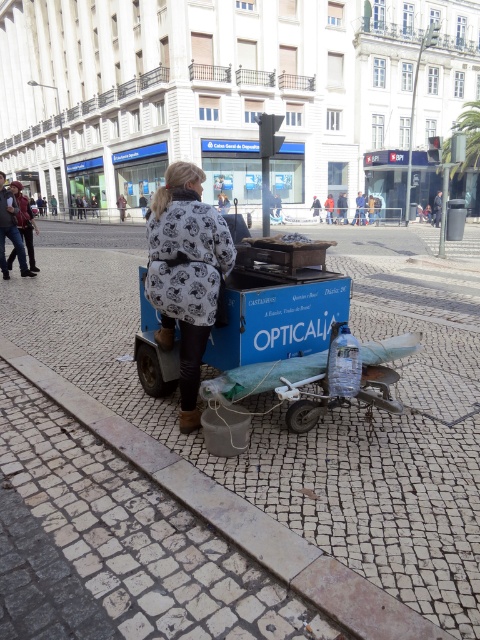
Question: Does cobblestone pavement at center have a larger size compared to white printed coat at center?

Choices:
 (A) no
 (B) yes

Answer: (B)

Question: Can you confirm if cobblestone pavement at center is thinner than white printed coat at center?

Choices:
 (A) yes
 (B) no

Answer: (B)

Question: Among these objects, which one is nearest to the camera?

Choices:
 (A) cobblestone pavement at center
 (B) white printed coat at center

Answer: (A)

Question: Is cobblestone pavement at center bigger than white printed coat at center?

Choices:
 (A) yes
 (B) no

Answer: (A)